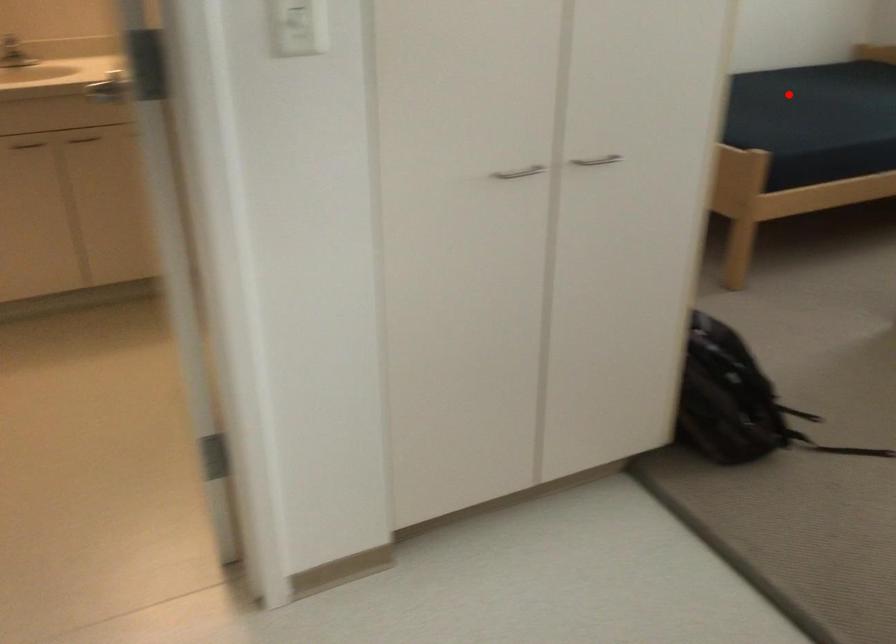
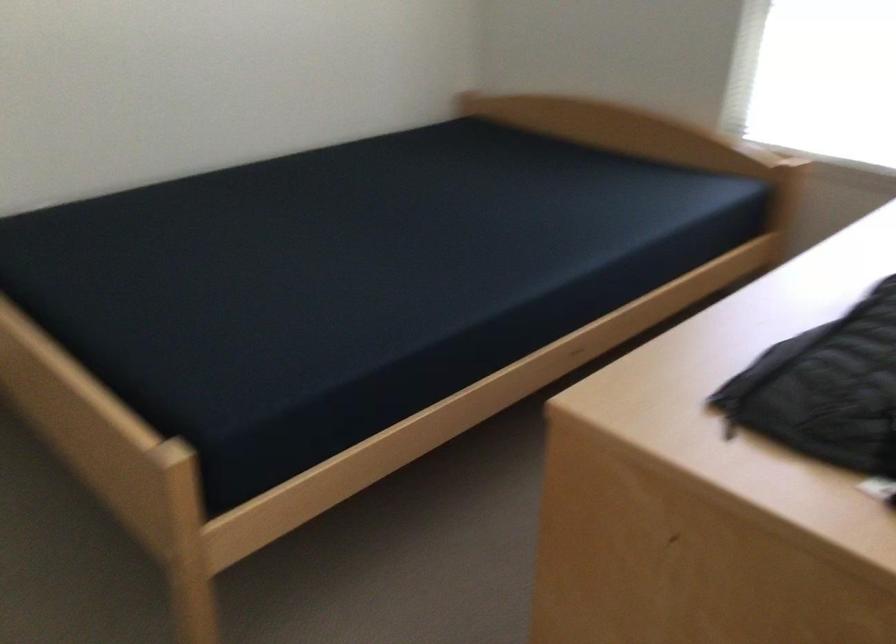
In the second image, find the point that corresponds to the highlighted location in the first image.

(362, 256)